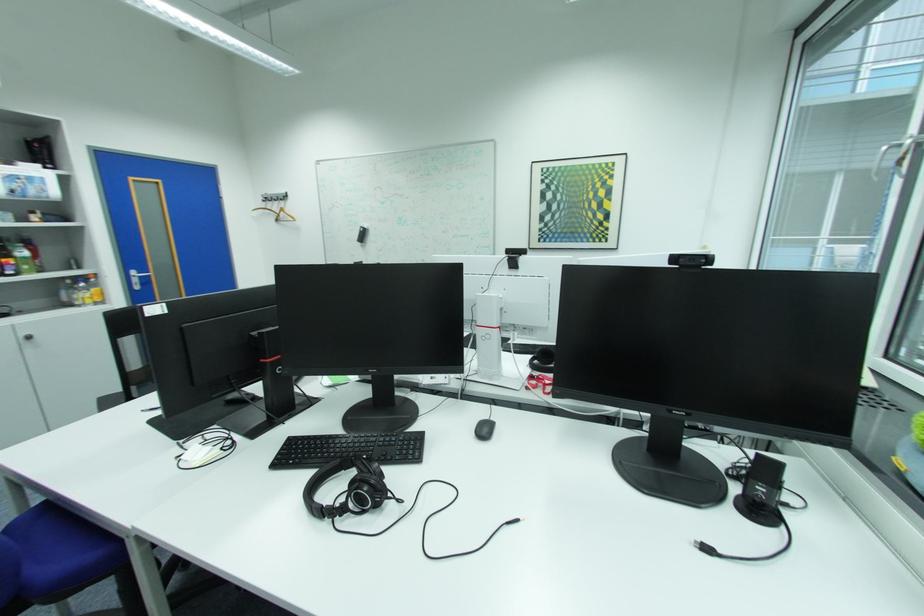
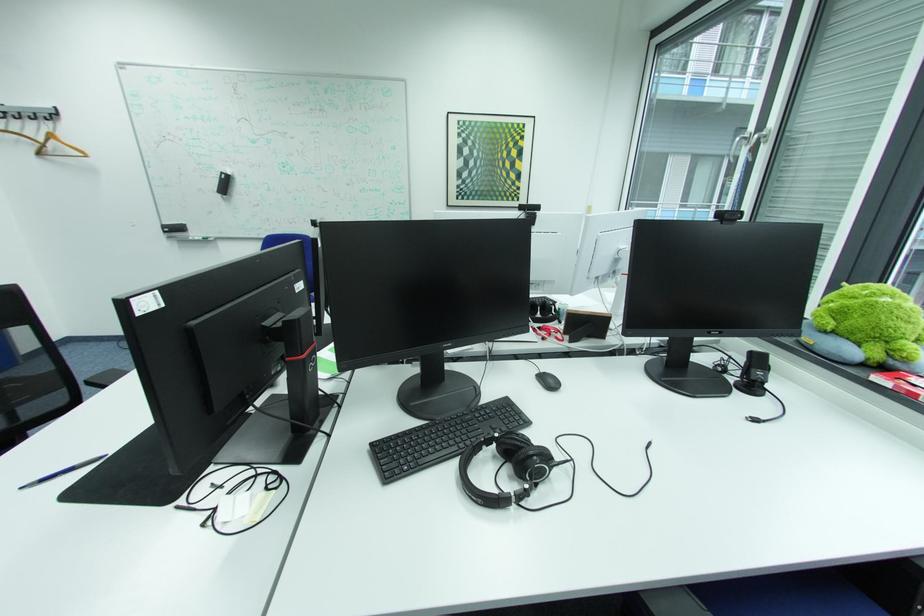
Where in the second image is the point corresponding to the point at 319,438 from the first image?

(406, 437)